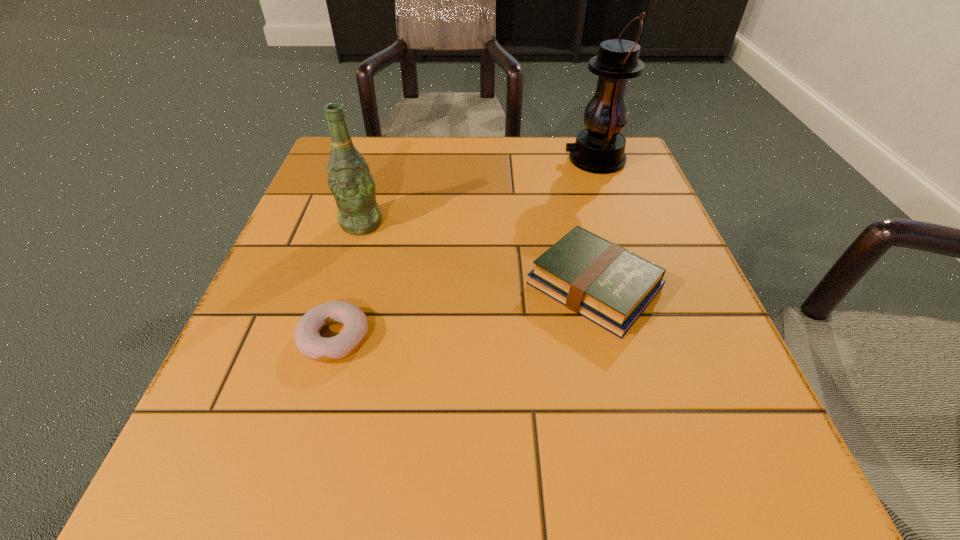
Identify the location of blank region between the second farthest object and the tallest object. The height and width of the screenshot is (540, 960). (478, 192).

This screenshot has width=960, height=540. I want to click on free spot between the tallest object and the second tallest object, so click(x=478, y=192).

Identify the location of empty space between the farthest object and the shortest object. The height and width of the screenshot is (540, 960). (465, 249).

I want to click on vacant space that is in between the doughnut and the third tallest object, so click(465, 312).

The height and width of the screenshot is (540, 960). In order to click on the second closest object to the doughnut in this screenshot , I will do `click(605, 283)`.

Locate an element on the screen. This screenshot has width=960, height=540. the closest object to the farthest object is located at coordinates (605, 283).

The width and height of the screenshot is (960, 540). Find the location of `free region that satisfies the following two spatial constraints: 1. above the tallest object, indicating its light source; 2. on the surface of the third nearest object`. free region that satisfies the following two spatial constraints: 1. above the tallest object, indicating its light source; 2. on the surface of the third nearest object is located at coordinates (617, 224).

Locate an element on the screen. blank area in the image that satisfies the following two spatial constraints: 1. on the surface of the second farthest object; 2. on the left side of the shortest object is located at coordinates (327, 338).

This screenshot has width=960, height=540. Find the location of `vacant space that satisfies the following two spatial constraints: 1. on the surface of the third shortest object; 2. on the right side of the book`. vacant space that satisfies the following two spatial constraints: 1. on the surface of the third shortest object; 2. on the right side of the book is located at coordinates (343, 286).

Locate an element on the screen. free space in the image that satisfies the following two spatial constraints: 1. on the surface of the beer bottle; 2. on the right side of the second shortest object is located at coordinates (343, 286).